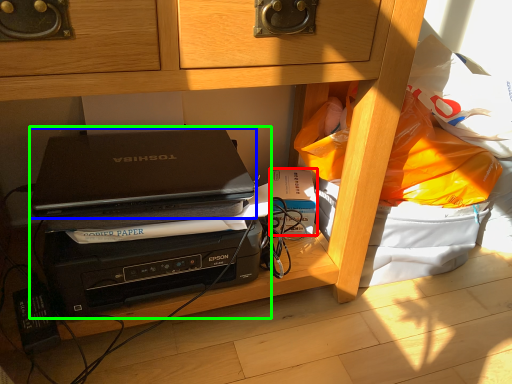
Question: Which is farther away from paperback book (highlighted by a red box)? laptop (highlighted by a blue box) or computer (highlighted by a green box)?

Choices:
 (A) laptop
 (B) computer

Answer: (B)